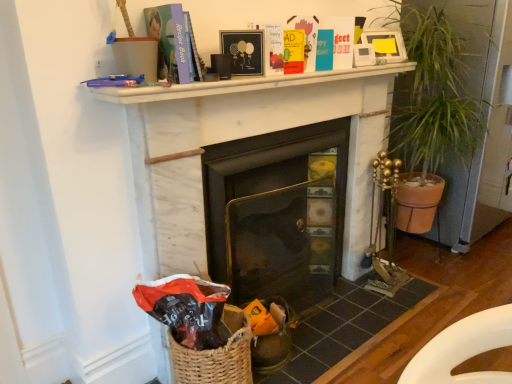
I want to click on vacant space underneath woven basket at lower left (from a real-world perspective), so click(x=349, y=317).